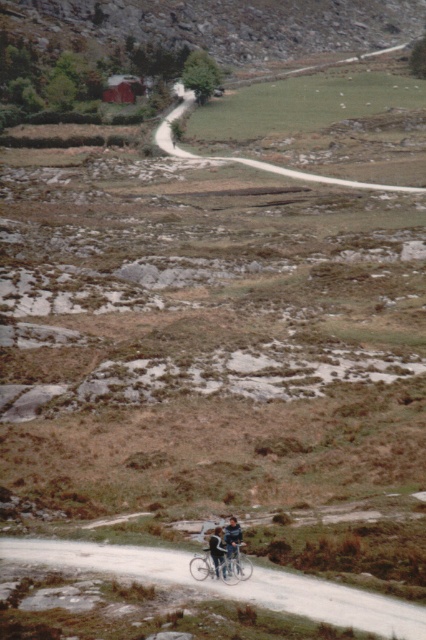
Who is positioned more to the left, denim jacket at lower center or denim pants at lower center?

denim jacket at lower center

Does denim jacket at lower center have a greater height compared to denim pants at lower center?

Yes.

Describe the element at coordinates (226, 544) in the screenshot. This screenshot has width=426, height=640. I see `denim jacket at lower center` at that location.

Locate an element on the screen. Image resolution: width=426 pixels, height=640 pixels. denim jacket at lower center is located at coordinates (226, 544).

Does metallic silver mountain bike at lower center appear on the left side of denim pants at lower center?

In fact, metallic silver mountain bike at lower center is to the right of denim pants at lower center.

Does metallic silver mountain bike at lower center appear under denim pants at lower center?

Yes, metallic silver mountain bike at lower center is below denim pants at lower center.

Is point (238, 563) closer to camera compared to point (221, 563)?

That is False.

Find the location of a particular element. metallic silver mountain bike at lower center is located at coordinates (221, 566).

From the picture: Between smooth gravel path at center and metallic silver mountain bike at lower center, which one appears on the left side from the viewer's perspective?

smooth gravel path at center is more to the left.

Is smooth gravel path at center above metallic silver mountain bike at lower center?

Incorrect, smooth gravel path at center is not positioned above metallic silver mountain bike at lower center.

At what (x,y) coordinates should I click in order to perform the action: click on smooth gravel path at center. Please return your answer as a coordinate pair (x, y). The width and height of the screenshot is (426, 640). Looking at the image, I should click on (233, 586).